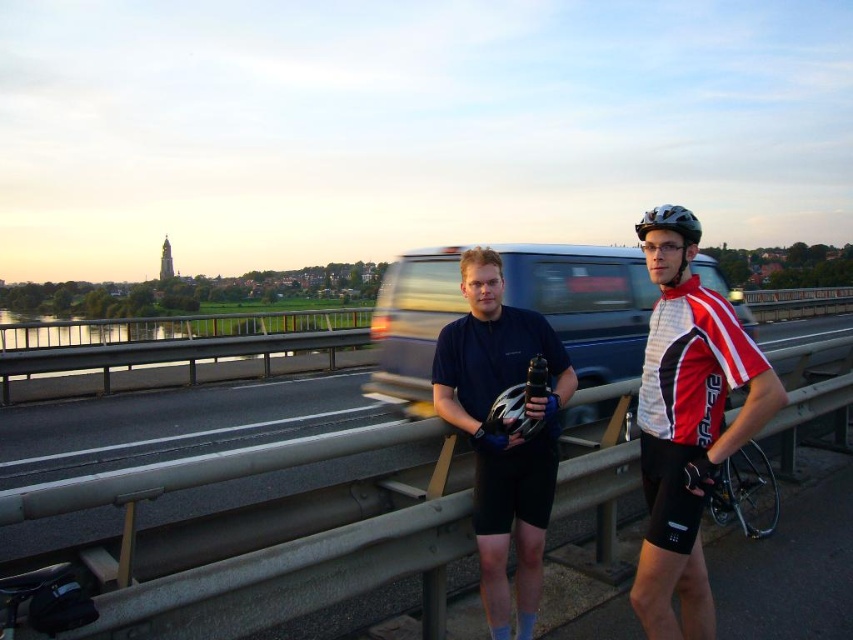
The image size is (853, 640). What do you see at coordinates (688, 433) in the screenshot?
I see `red and white jersey at center` at bounding box center [688, 433].

Identify the location of red and white jersey at center. This screenshot has width=853, height=640. (688, 433).

Who is positioned more to the right, red and white jersey at center or metallic blue van at center?

metallic blue van at center

Between red and white jersey at center and metallic blue van at center, which one has less height?

With less height is red and white jersey at center.

The image size is (853, 640). Describe the element at coordinates (688, 433) in the screenshot. I see `red and white jersey at center` at that location.

I want to click on red and white jersey at center, so click(x=688, y=433).

Is silver metallic bicycle at center closer to the viewer compared to matte black helmet at upper right?

No, silver metallic bicycle at center is further to the viewer.

What do you see at coordinates (746, 492) in the screenshot?
I see `silver metallic bicycle at center` at bounding box center [746, 492].

Is point (743, 504) positioned in front of point (695, 241)?

That is False.

Identify the location of silver metallic bicycle at center. (746, 492).